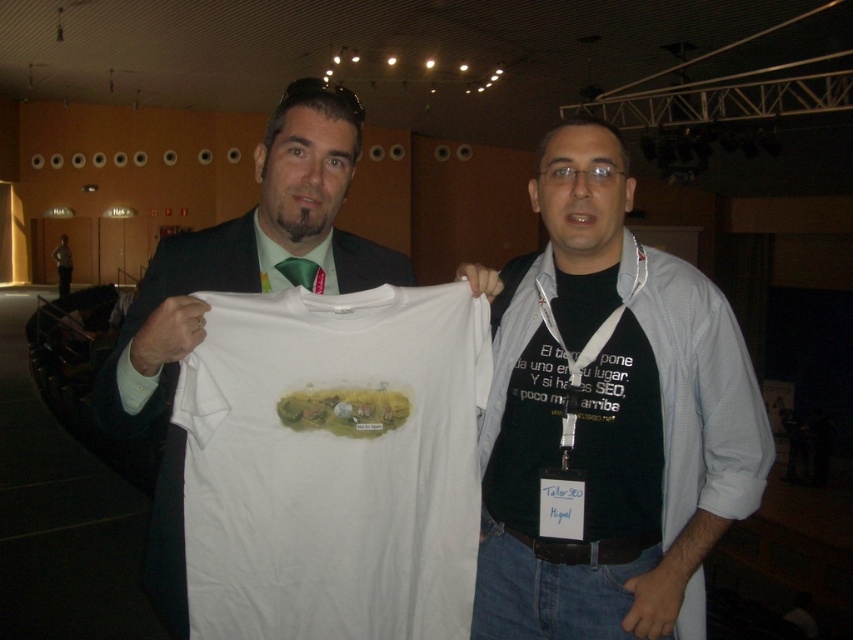
The width and height of the screenshot is (853, 640). What do you see at coordinates (610, 417) in the screenshot? I see `black cotton shirt at center` at bounding box center [610, 417].

Does point (584, 433) lie in front of point (305, 285)?

Yes, it is in front of point (305, 285).

I want to click on black cotton shirt at center, so click(x=610, y=417).

This screenshot has height=640, width=853. Find the location of `black cotton shirt at center`. black cotton shirt at center is located at coordinates (610, 417).

Which of these two, white cotton t-shirt at center or black cotton shirt at center, stands taller?

black cotton shirt at center

Is white cotton t-shirt at center positioned behind black cotton shirt at center?

No.

Between point (254, 372) and point (735, 433), which one is positioned in front?

Point (254, 372) is in front.

Identify the location of white cotton t-shirt at center. (334, 464).

Is point (300, 384) more distant than point (311, 269)?

No.

Looking at this image, can you confirm if white cotton t-shirt at center is positioned to the right of green silk tie at upper center?

Yes, white cotton t-shirt at center is to the right of green silk tie at upper center.

Image resolution: width=853 pixels, height=640 pixels. I want to click on white cotton t-shirt at center, so click(334, 464).